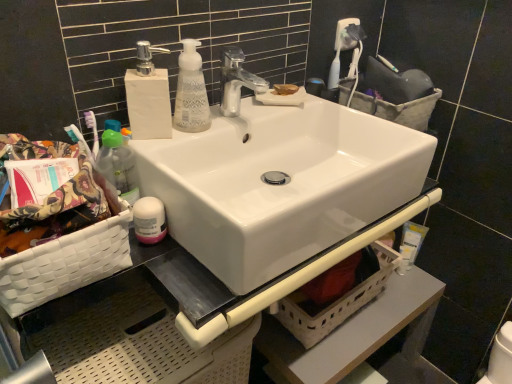
Question: Is beige woven basket at lower center, which is the second basket from front to back, closer to the viewer compared to white matte soap dispenser at upper left?

Choices:
 (A) no
 (B) yes

Answer: (A)

Question: Is beige woven basket at lower center, which is the second basket from front to back, oriented towards white matte soap dispenser at upper left?

Choices:
 (A) no
 (B) yes

Answer: (A)

Question: Is beige woven basket at lower center, marked as the third basket in a top-to-bottom arrangement, at the right side of white matte soap dispenser at upper left?

Choices:
 (A) no
 (B) yes

Answer: (B)

Question: Is beige woven basket at lower center, marked as the 2th basket in a back-to-front arrangement, taller than white matte soap dispenser at upper left?

Choices:
 (A) yes
 (B) no

Answer: (A)

Question: Considering the relative sizes of beige woven basket at lower center, the second basket in the right-to-left sequence, and white matte soap dispenser at upper left in the image provided, is beige woven basket at lower center, the second basket in the right-to-left sequence, shorter than white matte soap dispenser at upper left?

Choices:
 (A) yes
 (B) no

Answer: (B)

Question: From a real-world perspective, is white glossy faucet at upper center above or below pink glossy lotion at lower left, the first toiletry when ordered from top to bottom?

Choices:
 (A) above
 (B) below

Answer: (A)

Question: Is point (254, 92) closer or farther from the camera than point (157, 236)?

Choices:
 (A) closer
 (B) farther

Answer: (B)

Question: Is white glossy faucet at upper center taller or shorter than pink glossy lotion at lower left, which ranks as the 1th toiletry in left-to-right order?

Choices:
 (A) short
 (B) tall

Answer: (B)

Question: Which is correct: white glossy faucet at upper center is inside pink glossy lotion at lower left, arranged as the 2th toiletry when ordered from the bottom, or outside of it?

Choices:
 (A) inside
 (B) outside

Answer: (B)

Question: Is point (412, 236) positioned closer to the camera than point (157, 205)?

Choices:
 (A) farther
 (B) closer

Answer: (A)

Question: Is white plastic lotion at right, the first toiletry in the right-to-left sequence, in front of or behind pink glossy lotion at lower left, acting as the second toiletry starting from the back, in the image?

Choices:
 (A) front
 (B) behind

Answer: (B)

Question: From the image's perspective, is white plastic lotion at right, arranged as the first toiletry when viewed from the back, positioned above or below pink glossy lotion at lower left, arranged as the 2th toiletry when ordered from the bottom?

Choices:
 (A) below
 (B) above

Answer: (A)

Question: Looking at the image, does white plastic lotion at right, arranged as the second toiletry when viewed from the left, seem bigger or smaller compared to pink glossy lotion at lower left, positioned as the 2th toiletry in right-to-left order?

Choices:
 (A) big
 (B) small

Answer: (A)

Question: Would you say beige woven basket at lower center, the second basket in the right-to-left sequence, is inside or outside white matte soap dispenser at upper left?

Choices:
 (A) outside
 (B) inside

Answer: (A)

Question: Based on their sizes in the image, would you say beige woven basket at lower center, marked as the 2th basket in a back-to-front arrangement, is bigger or smaller than white matte soap dispenser at upper left?

Choices:
 (A) small
 (B) big

Answer: (B)